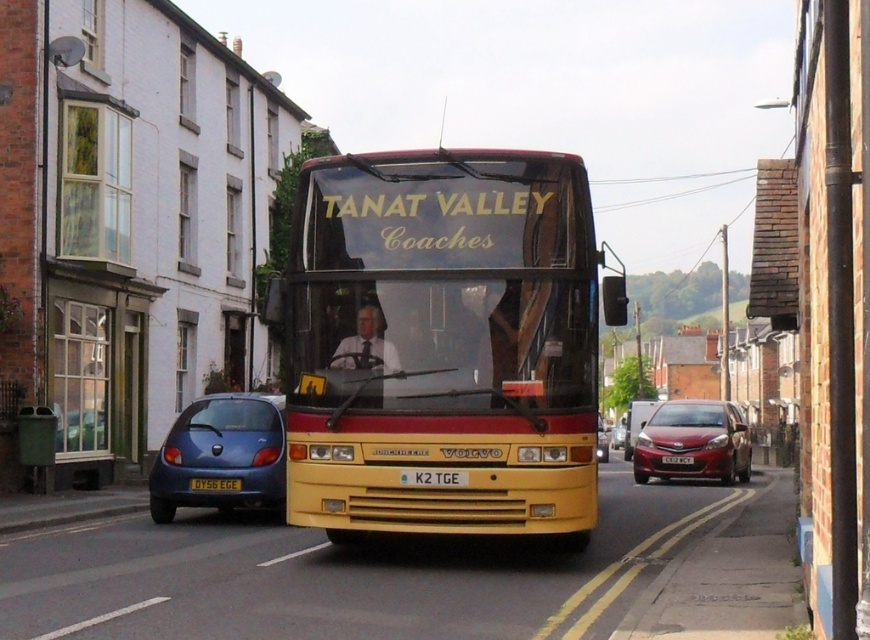
You are a delivery driver who needs to park your van between the metallic blue hatchback at lower left and the shiny red sedan at right. Can you fit your van, which is 5 meters long, in the available space between them?

The metallic blue hatchback at lower left is smaller than the shiny red sedan at right, but the exact distance between them isn not provided. Without knowing the space between the two vehicles, it is impossible to determine if the van will fit.